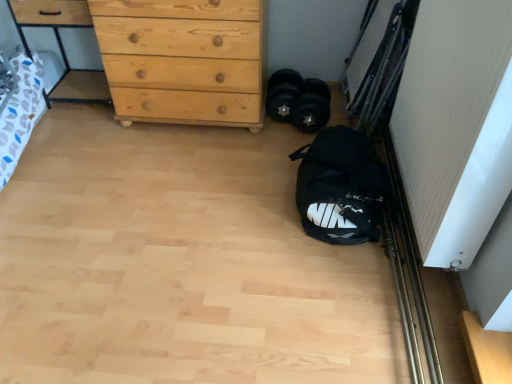
Where is `natural wood chest of drawers at upper left`? natural wood chest of drawers at upper left is located at coordinates (183, 60).

Identify the location of natural wood dresser at upper left. The width and height of the screenshot is (512, 384). (50, 20).

Locate an element on the screen. This screenshot has width=512, height=384. black rubber dumbbells at center is located at coordinates (283, 94).

The height and width of the screenshot is (384, 512). Identify the location of black fabric sack at lower right. (341, 187).

This screenshot has width=512, height=384. What do you see at coordinates (341, 187) in the screenshot?
I see `black fabric sack at lower right` at bounding box center [341, 187].

At what (x,y) coordinates should I click in order to perform the action: click on natural wood chest of drawers at upper left. Please return your answer as a coordinate pair (x, y). Looking at the image, I should click on 183,60.

Considering the sizes of black fabric sack at lower right and natural wood dresser at upper left in the image, is black fabric sack at lower right wider or thinner than natural wood dresser at upper left?

Considering their sizes, black fabric sack at lower right looks broader than natural wood dresser at upper left.

Does point (343, 171) come in front of point (46, 9)?

Yes, it is.

Considering the relative sizes of black fabric sack at lower right and natural wood dresser at upper left in the image provided, is black fabric sack at lower right smaller than natural wood dresser at upper left?

Yes.

From a real-world perspective, which object rests below the other?

black fabric sack at lower right, from a real-world perspective.

Could you tell me if natural wood chest of drawers at upper left is facing natural wood dresser at upper left?

No.

Does natural wood chest of drawers at upper left appear on the left side of natural wood dresser at upper left?

Incorrect, natural wood chest of drawers at upper left is not on the left side of natural wood dresser at upper left.

From a real-world perspective, is natural wood chest of drawers at upper left below natural wood dresser at upper left?

Actually, natural wood chest of drawers at upper left is physically above natural wood dresser at upper left in the real world.

Is natural wood chest of drawers at upper left wider or thinner than natural wood dresser at upper left?

Considering their sizes, natural wood chest of drawers at upper left looks broader than natural wood dresser at upper left.

Is black rubber dumbbells at center situated inside natural wood chest of drawers at upper left or outside?

black rubber dumbbells at center cannot be found inside natural wood chest of drawers at upper left.

From the image's perspective, is black rubber dumbbells at center above natural wood chest of drawers at upper left?

Incorrect, from the image's perspective, black rubber dumbbells at center is lower than natural wood chest of drawers at upper left.

Considering the sizes of objects black rubber dumbbells at center and natural wood chest of drawers at upper left in the image provided, who is wider, black rubber dumbbells at center or natural wood chest of drawers at upper left?

Wider between the two is natural wood chest of drawers at upper left.

Consider the image. Which object is further away from the camera taking this photo, black rubber dumbbells at center or natural wood chest of drawers at upper left?

black rubber dumbbells at center is further away from the camera.

Between point (79, 99) and point (300, 84), which one is positioned behind?

The point (79, 99) is farther.

In the image, is natural wood dresser at upper left on the left side or the right side of black rubber dumbbells at center?

In the image, natural wood dresser at upper left appears on the left side of black rubber dumbbells at center.

How much distance is there between natural wood dresser at upper left and black rubber dumbbells at center?

The distance of natural wood dresser at upper left from black rubber dumbbells at center is 1.09 meters.

Is natural wood dresser at upper left oriented away from black rubber dumbbells at center?

No, natural wood dresser at upper left is not facing away from black rubber dumbbells at center.

From a real-world perspective, is white textured screen door at right physically below black fabric sack at lower right?

No, from a real-world perspective, white textured screen door at right is not below black fabric sack at lower right.

Which object is thinner, white textured screen door at right or black fabric sack at lower right?

With smaller width is white textured screen door at right.

Is white textured screen door at right oriented away from black fabric sack at lower right?

No, white textured screen door at right's orientation is not away from black fabric sack at lower right.

Consider the image. Can you confirm if white textured screen door at right is positioned to the right of black fabric sack at lower right?

Indeed, white textured screen door at right is positioned on the right side of black fabric sack at lower right.

Does black rubber dumbbells at center touch black fabric sack at lower right?

black rubber dumbbells at center is not next to black fabric sack at lower right, and they're not touching.

In the scene shown: Is black rubber dumbbells at center inside the boundaries of black fabric sack at lower right, or outside?

black rubber dumbbells at center is spatially situated outside black fabric sack at lower right.

Looking at the image, does black rubber dumbbells at center seem bigger or smaller compared to black fabric sack at lower right?

black rubber dumbbells at center is smaller than black fabric sack at lower right.

The height and width of the screenshot is (384, 512). I want to click on footwear below the black fabric sack at lower right (from a real-world perspective), so click(x=283, y=94).

Between black fabric sack at lower right and black rubber dumbbells at center, which one has smaller size?

Smaller between the two is black rubber dumbbells at center.

In terms of height, does black fabric sack at lower right look taller or shorter compared to black rubber dumbbells at center?

In the image, black fabric sack at lower right appears to be taller than black rubber dumbbells at center.

From the image's perspective, which is below, black fabric sack at lower right or black rubber dumbbells at center?

From the image's view, black fabric sack at lower right is below.

Where is `cabinetry that appears behind the black fabric sack at lower right`? cabinetry that appears behind the black fabric sack at lower right is located at coordinates (50, 20).

Where is `cabinetry located above the natural wood chest of drawers at upper left (from the image's perspective)`? This screenshot has width=512, height=384. cabinetry located above the natural wood chest of drawers at upper left (from the image's perspective) is located at coordinates (50, 20).

From the image, which object appears to be nearer to natural wood chest of drawers at upper left, natural wood dresser at upper left or black fabric sack at lower right?

natural wood dresser at upper left is positioned closer to the anchor natural wood chest of drawers at upper left.

Which object lies nearer to the anchor point natural wood dresser at upper left, black fabric sack at lower right or black rubber dumbbells at center?

Among the two, black rubber dumbbells at center is located nearer to natural wood dresser at upper left.

When comparing their distances from white textured screen door at right, does black fabric sack at lower right or natural wood chest of drawers at upper left seem further?

natural wood chest of drawers at upper left is positioned further to the anchor white textured screen door at right.

Looking at this image, which object lies nearer to the anchor point natural wood chest of drawers at upper left, white textured screen door at right or natural wood dresser at upper left?

natural wood dresser at upper left.

Considering their positions, is natural wood chest of drawers at upper left positioned closer to black fabric sack at lower right than white textured screen door at right?

white textured screen door at right is closer to black fabric sack at lower right.

From the image, which object appears to be nearer to white textured screen door at right, natural wood dresser at upper left or natural wood chest of drawers at upper left?

Among the two, natural wood chest of drawers at upper left is located nearer to white textured screen door at right.

Considering their positions, is black rubber dumbbells at center positioned closer to natural wood dresser at upper left than black fabric sack at lower right?

black rubber dumbbells at center.

From the image, which object appears to be farther from natural wood chest of drawers at upper left, natural wood dresser at upper left or black rubber dumbbells at center?

Based on the image, natural wood dresser at upper left appears to be further to natural wood chest of drawers at upper left.

Where is `sack between natural wood dresser at upper left and white textured screen door at right`? The width and height of the screenshot is (512, 384). sack between natural wood dresser at upper left and white textured screen door at right is located at coordinates (341, 187).

In order to click on the chest of drawers situated between natural wood dresser at upper left and white textured screen door at right from left to right in this screenshot , I will do `click(183, 60)`.

Identify the location of the chest of drawers located between natural wood dresser at upper left and black fabric sack at lower right in the left-right direction. The width and height of the screenshot is (512, 384). (183, 60).

The width and height of the screenshot is (512, 384). I want to click on footwear between natural wood dresser at upper left and black fabric sack at lower right, so click(x=283, y=94).